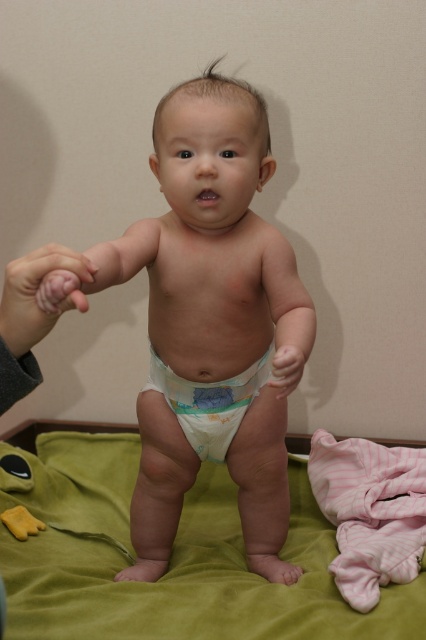
Can you confirm if white cloth diaper at center is bigger than pink soft skin at left?

Indeed, white cloth diaper at center has a larger size compared to pink soft skin at left.

Is white cloth diaper at center wider than pink soft skin at left?

Yes, white cloth diaper at center is wider than pink soft skin at left.

Which is in front, point (207, 189) or point (22, 273)?

Positioned in front is point (22, 273).

The height and width of the screenshot is (640, 426). I want to click on white cloth diaper at center, so click(x=210, y=323).

Between point (204, 435) and point (6, 522), which one is positioned in front?

Point (204, 435) is in front.

Is point (242, 394) farther from camera compared to point (25, 531)?

No, (242, 394) is closer to viewer.

Is point (195, 394) less distant than point (29, 513)?

Yes, it is in front of point (29, 513).

You are a GUI agent. You are given a task and a screenshot of the screen. Output one action in this format:
    pyautogui.click(x=<x>, y=<y>)
    Task: Click on the white disposable diaper at center
    The width and height of the screenshot is (426, 640).
    Given the screenshot: What is the action you would take?
    pyautogui.click(x=209, y=403)

Does white cloth diaper at center have a larger size compared to white disposable diaper at center?

Yes, white cloth diaper at center is bigger than white disposable diaper at center.

How far apart are white cloth diaper at center and white disposable diaper at center?

The distance of white cloth diaper at center from white disposable diaper at center is 4.53 inches.

Between point (158, 573) and point (198, 419), which one is positioned in front?

Point (198, 419) is more forward.

Locate an element on the screen. The image size is (426, 640). white cloth diaper at center is located at coordinates (210, 323).